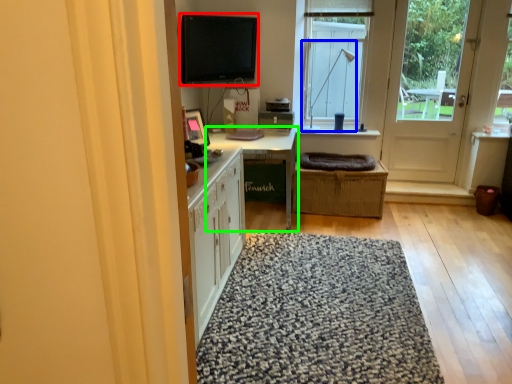
Question: Based on their relative distances, which object is nearer to computer monitor (highlighted by a red box)? Choose from lamp (highlighted by a blue box) and table (highlighted by a green box).

Choices:
 (A) lamp
 (B) table

Answer: (B)